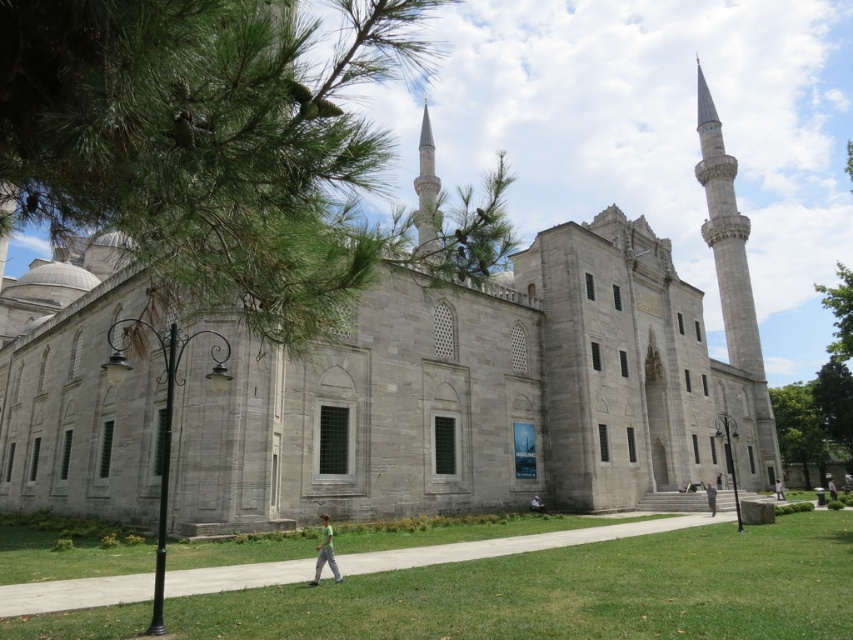
Which is behind, point (256, 342) or point (107, 630)?

Point (256, 342)

Which is more to the right, gray stone mosque at center or green grass at lower center?

green grass at lower center

What do you see at coordinates (494, 387) in the screenshot?
I see `gray stone mosque at center` at bounding box center [494, 387].

Where is `gray stone mosque at center`? The height and width of the screenshot is (640, 853). gray stone mosque at center is located at coordinates (494, 387).

Between point (662, 346) and point (833, 486), which one is positioned in front?

Point (662, 346) is more forward.

Describe the element at coordinates (494, 387) in the screenshot. I see `gray stone mosque at center` at that location.

Which is behind, point (491, 468) or point (828, 480)?

Point (828, 480)

At what (x,y) coordinates should I click in order to perform the action: click on gray stone mosque at center. Please return your answer as a coordinate pair (x, y). The width and height of the screenshot is (853, 640). Looking at the image, I should click on (494, 387).

Between point (184, 209) and point (318, 580), which one is positioned in front?

Point (184, 209) is more forward.

Can you confirm if green leafy tree at upper left is shorter than green fabric shirt at lower center?

In fact, green leafy tree at upper left may be taller than green fabric shirt at lower center.

Is point (151, 182) positioned in front of point (328, 538)?

Yes.

Find the location of a particular element. The height and width of the screenshot is (640, 853). green leafy tree at upper left is located at coordinates (206, 141).